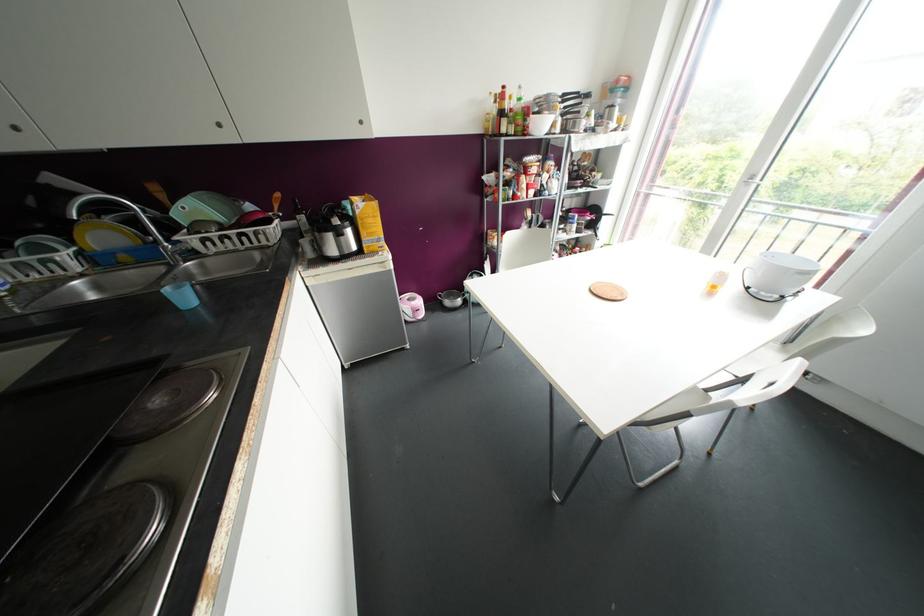
The image size is (924, 616). I want to click on small yellow bottle, so click(715, 283).